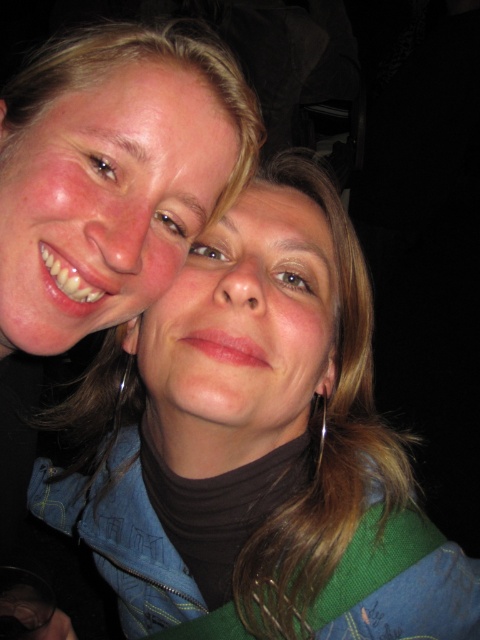
You are a photographer holding a camera and want to take a closeup shot of the person on the left. The camera is positioned at point (444, 573). The camera has a focal length of 50mm and an aperture of f2.8. The subject is 21.73 inches away from the camera. To ensure the subject is in focus, what is the minimum depth of field required?

The minimum depth of field required is 21.73 inches to ensure the subject on the left is in focus.

You are a photographer adjusting the camera settings for a group photo. The camera has a focus range of 15 centimeters. You need to ensure that both the matte blue jacket at upper left and the silver metallic earring at lower center are in focus. Based on the scene description, can both objects be in focus simultaneously?

The distance between the matte blue jacket at upper left and the silver metallic earring at lower center is 17.21 centimeters. Since the camera has a focus range of 15 centimeters, the objects are beyond the focus range. Therefore, both cannot be in focus at the same time.

You are a photographer adjusting the lighting for a portrait. You notice the matte blue jacket at upper left and want to ensure it is well lit. Given its position at coordinates point 0.697, 0.533, can you determine if it is positioned to the left or right of the center of the image?

The matte blue jacket at upper left is located at point (255,445). Since the x coordinate is 0.697, which is greater than 0.5, it is positioned to the right of the center of the image.